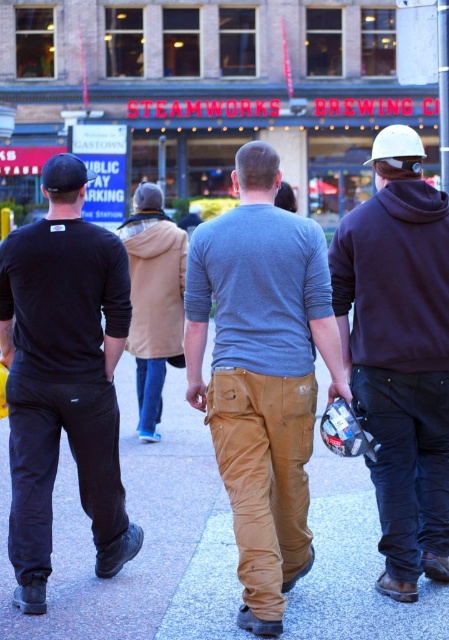
The height and width of the screenshot is (640, 449). What do you see at coordinates (262, 372) in the screenshot? I see `matte gray sweater at center` at bounding box center [262, 372].

Is point (251, 464) closer to camera compared to point (80, 236)?

Yes.

Is point (193, 262) positioned after point (8, 246)?

No, (193, 262) is in front of (8, 246).

Where is `matte gray sweater at center`? Image resolution: width=449 pixels, height=640 pixels. matte gray sweater at center is located at coordinates (262, 372).

Is matte gray sweater at center to the right of khaki pants at center from the viewer's perspective?

Indeed, matte gray sweater at center is positioned on the right side of khaki pants at center.

Between point (246, 604) and point (144, 320), which one is positioned behind?

The point (144, 320) is more distant.

I want to click on matte gray sweater at center, so click(x=262, y=372).

Between smooth concrete pavement at center and matte gray sweater at center, which one is positioned higher?

matte gray sweater at center

Consider the image. Who is shorter, smooth concrete pavement at center or matte gray sweater at center?

Standing shorter between the two is smooth concrete pavement at center.

At what (x,y) coordinates should I click in order to perform the action: click on smooth concrete pavement at center. Please return your answer as a coordinate pair (x, y). This screenshot has width=449, height=640. Looking at the image, I should click on (144, 541).

You are a GUI agent. You are given a task and a screenshot of the screen. Output one action in this format:
    pyautogui.click(x=<x>, y=<y>)
    Task: Click on the smooth concrete pavement at center
    
    Given the screenshot: What is the action you would take?
    pyautogui.click(x=144, y=541)